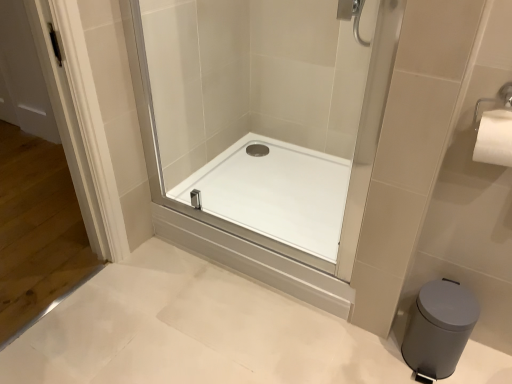
Question: Is white glossy shower tray at center at the back of transparent glass shower door at center?

Choices:
 (A) no
 (B) yes

Answer: (B)

Question: From the image's perspective, is transparent glass shower door at center on top of white glossy shower tray at center?

Choices:
 (A) yes
 (B) no

Answer: (A)

Question: Considering the relative sizes of transparent glass shower door at center and white glossy shower tray at center in the image provided, is transparent glass shower door at center smaller than white glossy shower tray at center?

Choices:
 (A) no
 (B) yes

Answer: (A)

Question: Can white glossy shower tray at center be found inside transparent glass shower door at center?

Choices:
 (A) no
 (B) yes

Answer: (A)

Question: Is transparent glass shower door at center placed right next to white glossy shower tray at center?

Choices:
 (A) no
 (B) yes

Answer: (A)

Question: Do you think transparent glass shower door at center is within white glossy shower tray at center, or outside of it?

Choices:
 (A) outside
 (B) inside

Answer: (A)

Question: In terms of size, does transparent glass shower door at center appear bigger or smaller than white glossy shower tray at center?

Choices:
 (A) small
 (B) big

Answer: (B)

Question: Does point (226, 6) appear closer or farther from the camera than point (333, 208)?

Choices:
 (A) farther
 (B) closer

Answer: (A)

Question: Considering their positions, is transparent glass shower door at center located in front of or behind white glossy shower tray at center?

Choices:
 (A) front
 (B) behind

Answer: (A)

Question: From a real-world perspective, is gray matte trash can at lower right physically located above or below white glossy shower tray at center?

Choices:
 (A) above
 (B) below

Answer: (B)

Question: Is gray matte trash can at lower right taller or shorter than white glossy shower tray at center?

Choices:
 (A) tall
 (B) short

Answer: (A)

Question: Considering the positions of point (456, 354) and point (265, 221), is point (456, 354) closer or farther from the camera than point (265, 221)?

Choices:
 (A) closer
 (B) farther

Answer: (A)

Question: From the image's perspective, is gray matte trash can at lower right located above or below white glossy shower tray at center?

Choices:
 (A) below
 (B) above

Answer: (A)

Question: In the image, is transparent glass shower door at center positioned in front of or behind gray matte trash can at lower right?

Choices:
 (A) front
 (B) behind

Answer: (A)

Question: Looking at the image, does transparent glass shower door at center seem bigger or smaller compared to gray matte trash can at lower right?

Choices:
 (A) big
 (B) small

Answer: (A)